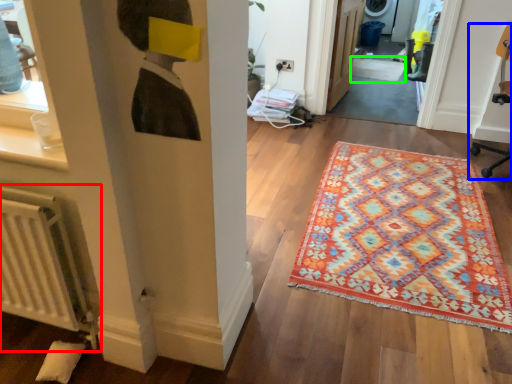
Question: Estimate the real-world distances between objects in this image. Which object is closer to radiator (highlighted by a red box), swivel chair (highlighted by a blue box) or doormat (highlighted by a green box)?

Choices:
 (A) swivel chair
 (B) doormat

Answer: (A)